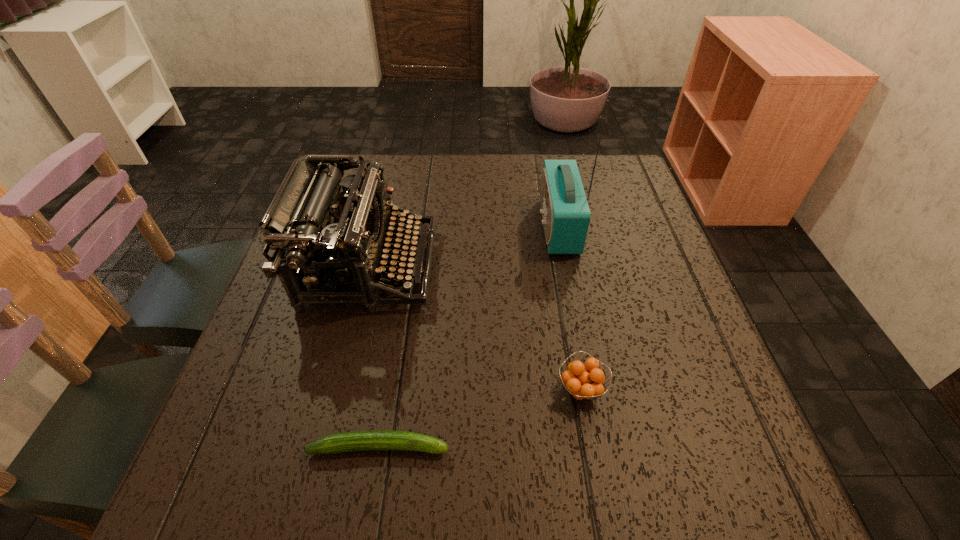
Find the location of a particular element. The width and height of the screenshot is (960, 540). the tallest object is located at coordinates (565, 212).

Where is `the second tallest object`? The width and height of the screenshot is (960, 540). the second tallest object is located at coordinates (309, 224).

Identify the location of orange fruit. Image resolution: width=960 pixels, height=540 pixels. (584, 382).

This screenshot has width=960, height=540. Find the location of `the third farthest object`. the third farthest object is located at coordinates (584, 382).

Locate an element on the screen. zucchini is located at coordinates (358, 440).

This screenshot has height=540, width=960. In order to click on the shortest object in this screenshot , I will do `click(358, 440)`.

Locate an element on the screen. vacant region located on the front panel of the radio receiver is located at coordinates (492, 226).

Identify the location of vacant region located 0.250m on the front panel of the radio receiver. (441, 226).

I want to click on vacant space situated on the front panel of the radio receiver, so click(x=425, y=226).

This screenshot has width=960, height=540. I want to click on free space located 0.270m on the typing side of the second tallest object, so click(550, 267).